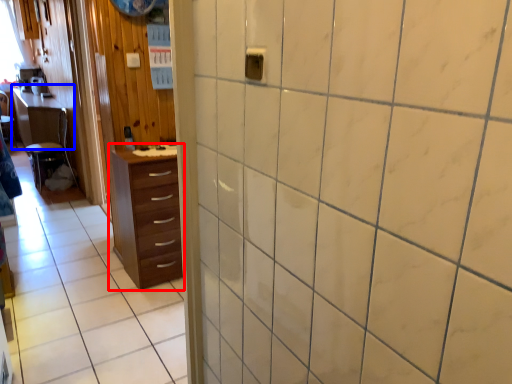
Question: Which of the following is the farthest to the observer, chest of drawers (highlighted by a red box) or table (highlighted by a blue box)?

Choices:
 (A) chest of drawers
 (B) table

Answer: (B)